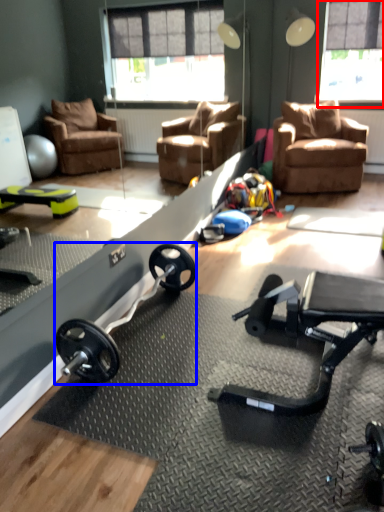
Question: Which object appears closest to the camera in this image, window screen (highlighted by a red box) or barbell (highlighted by a blue box)?

Choices:
 (A) window screen
 (B) barbell

Answer: (B)